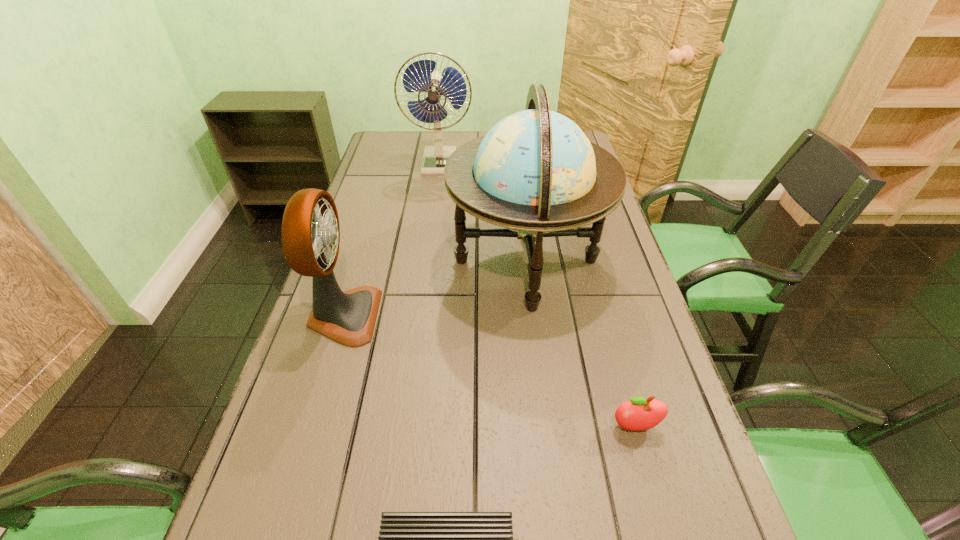
Identify the location of free point that satisfies the following two spatial constraints: 1. on the front-facing side of the farther fan; 2. on the front-facing side of the third tallest object. The image size is (960, 540). (419, 316).

Identify the location of free space that satisfies the following two spatial constraints: 1. on the front-facing side of the second nearest object; 2. on the right side of the farther fan. This screenshot has width=960, height=540. click(x=403, y=427).